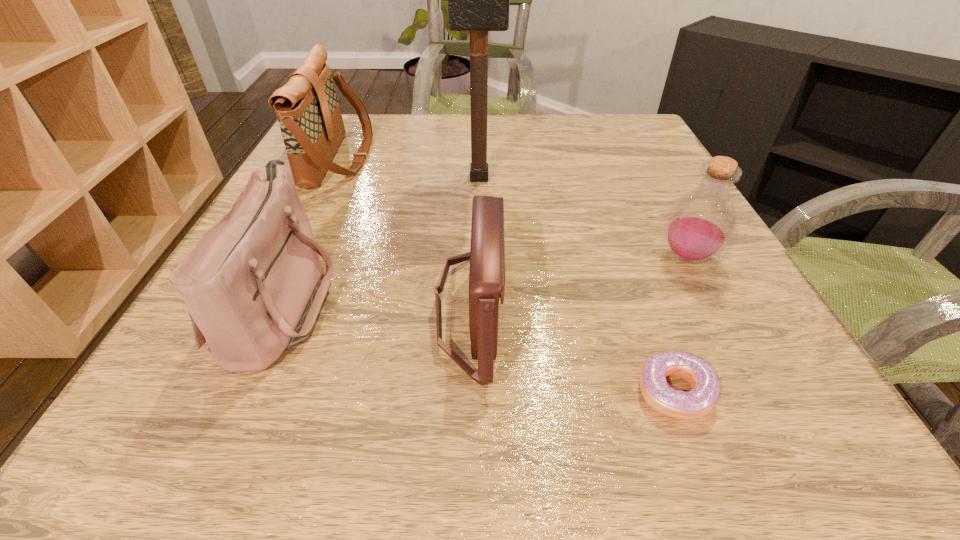
Locate an element on the screen. blank region between the rightmost object and the fifth tallest object is located at coordinates (578, 282).

Locate an element on the screen. The width and height of the screenshot is (960, 540). free space between the rightmost object and the tallest shoulder bag is located at coordinates (514, 207).

Where is `blank region between the mallet and the shortest object`? Image resolution: width=960 pixels, height=540 pixels. blank region between the mallet and the shortest object is located at coordinates (576, 285).

Image resolution: width=960 pixels, height=540 pixels. I want to click on free point between the tallest object and the tallest shoulder bag, so coord(410,168).

Find the location of a particular element. Image resolution: width=960 pixels, height=540 pixels. free point between the farthest shoulder bag and the shortest shoulder bag is located at coordinates (405, 233).

Identify the location of vacant point located between the farthest shoulder bag and the doughnut. (507, 275).

Point out which object is positioned as the fourth nearest to the tallest object. Please provide its 2D coordinates. Your answer should be formatted as a tuple, i.e. [(x, y)], where the tuple contains the x and y coordinates of a point satisfying the conditions above.

[(701, 223)]

In order to click on the closest object to the rightmost object in this screenshot , I will do `click(698, 402)`.

Where is `the second closest shoulder bag to the rightmost shoulder bag`? the second closest shoulder bag to the rightmost shoulder bag is located at coordinates (307, 108).

You are a GUI agent. You are given a task and a screenshot of the screen. Output one action in this format:
    pyautogui.click(x=<x>, y=<y>)
    Task: Click on the closest shoulder bag to the shortest shoulder bag
    
    Given the screenshot: What is the action you would take?
    coord(254,284)